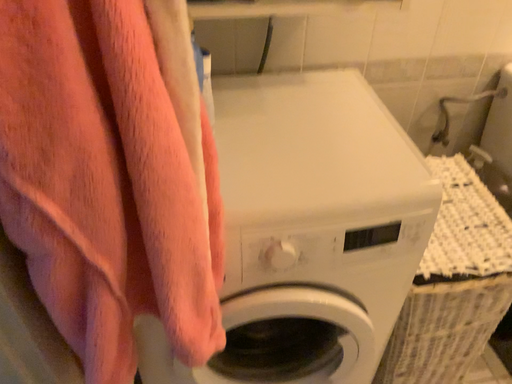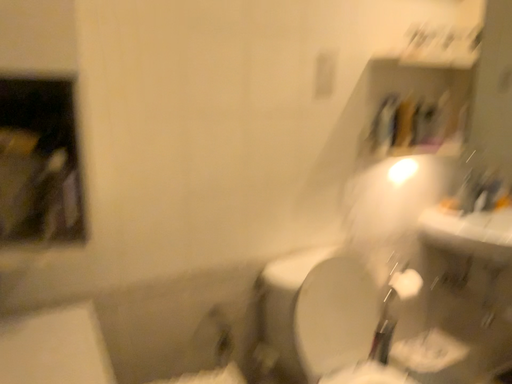
Question: How did the camera likely rotate when shooting the video?

Choices:
 (A) rotated left
 (B) rotated right

Answer: (B)